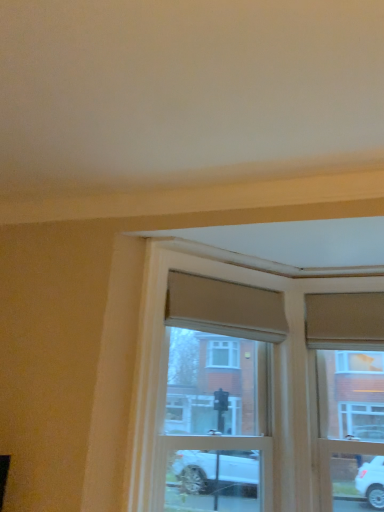
Question: Does wooden window frame at center have a lesser width compared to wooden window frame at upper right?

Choices:
 (A) no
 (B) yes

Answer: (A)

Question: From the image's perspective, is wooden window frame at center on top of wooden window frame at upper right?

Choices:
 (A) yes
 (B) no

Answer: (A)

Question: Is wooden window frame at center wider than wooden window frame at upper right?

Choices:
 (A) yes
 (B) no

Answer: (A)

Question: Is wooden window frame at center closer to camera compared to wooden window frame at upper right?

Choices:
 (A) yes
 (B) no

Answer: (A)

Question: Is wooden window frame at center not inside wooden window frame at upper right?

Choices:
 (A) yes
 (B) no

Answer: (A)

Question: From a real-world perspective, is wooden window frame at center on wooden window frame at upper right?

Choices:
 (A) yes
 (B) no

Answer: (B)

Question: From a real-world perspective, is wooden window frame at upper right on wooden window frame at center?

Choices:
 (A) no
 (B) yes

Answer: (B)

Question: Does wooden window frame at upper right have a greater height compared to wooden window frame at center?

Choices:
 (A) no
 (B) yes

Answer: (A)

Question: Is wooden window frame at upper right oriented away from wooden window frame at center?

Choices:
 (A) no
 (B) yes

Answer: (A)

Question: Considering the relative sizes of wooden window frame at upper right and wooden window frame at center in the image provided, is wooden window frame at upper right bigger than wooden window frame at center?

Choices:
 (A) no
 (B) yes

Answer: (A)

Question: Would you say wooden window frame at upper right is outside wooden window frame at center?

Choices:
 (A) yes
 (B) no

Answer: (A)

Question: Is wooden window frame at upper right further to the viewer compared to wooden window frame at center?

Choices:
 (A) yes
 (B) no

Answer: (A)

Question: Would you say wooden window frame at center is inside or outside wooden window frame at upper right?

Choices:
 (A) inside
 (B) outside

Answer: (B)